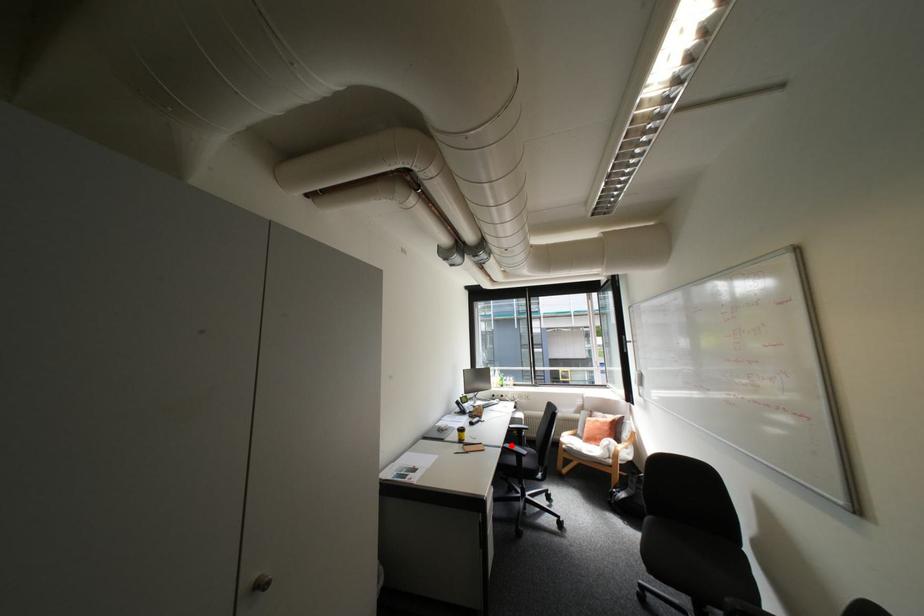
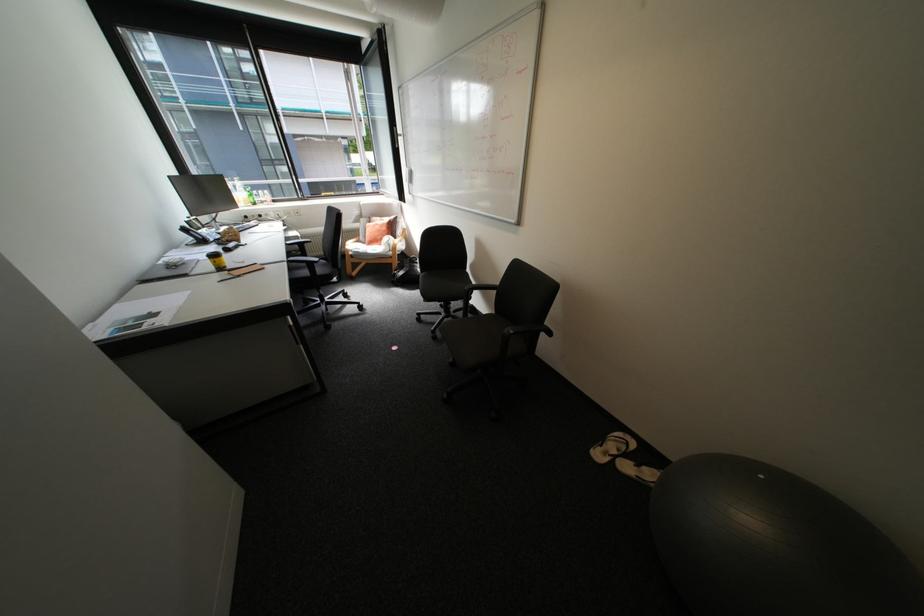
The point at the highlighted location is marked in the first image. Where is the corresponding point in the second image?

(295, 259)